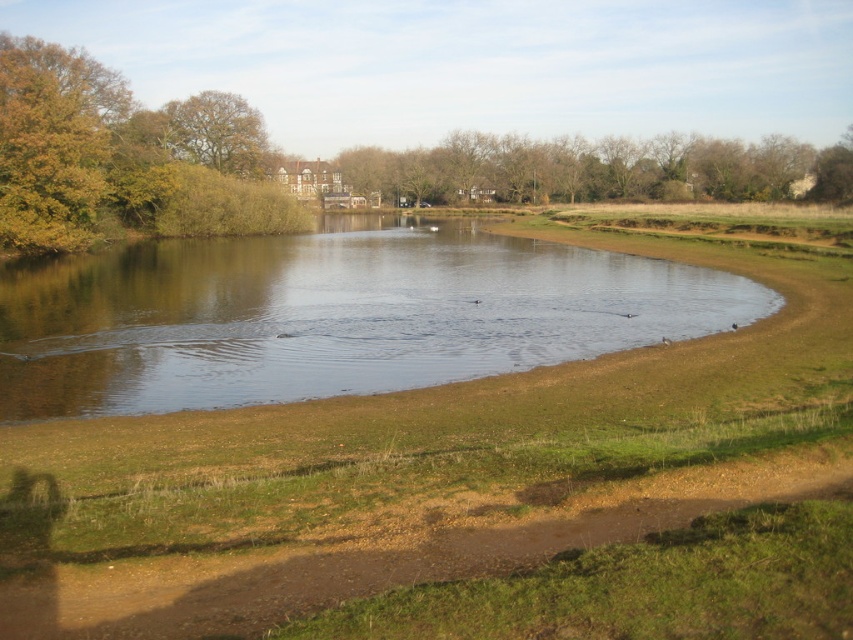
You are planning to plant a new tree between the green leafy trees at left and the brown leafy tree at upper left. The new tree requires a minimum of 12 meters of space between it and any existing trees. Is this spacing requirement met?

The distance between the green leafy trees at left and the brown leafy tree at upper left is 13.25 meters. Since the new tree requires a minimum of 12 meters of space, the existing spacing of 13.25 meters meets the requirement, so yes, the spacing requirement is satisfied.

You are an environmental scientist assessing the biodiversity of this lakeside area. You observe the green leafy trees at left and the brown leafy tree at upper left. Which group has a wider spread in terms of horizontal coverage?

The green leafy trees at left have a wider spread in terms of horizontal coverage than the brown leafy tree at upper left, as their width surpasses that of the brown leafy tree at upper left.